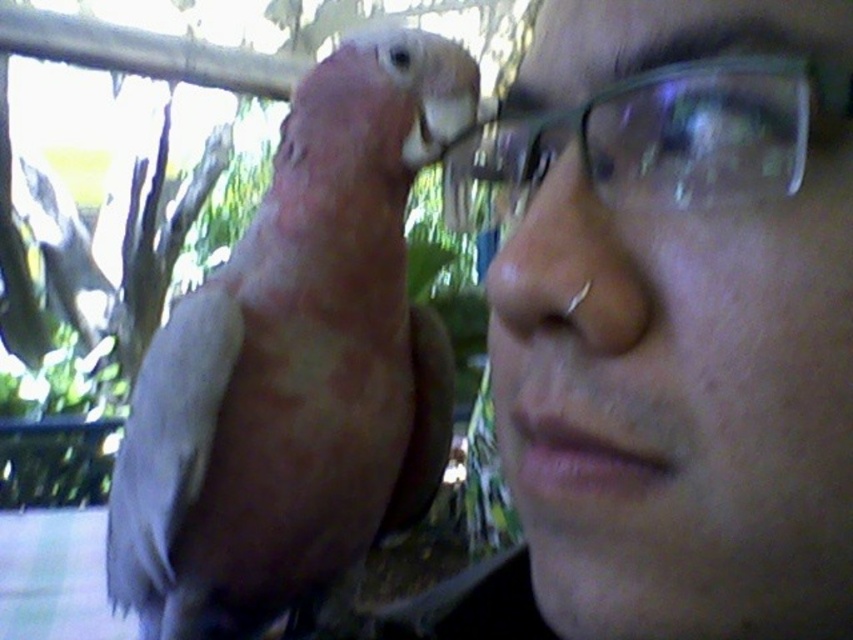
Who is lower down, matte pink parrot at upper left or clear plastic glasses at upper center?

matte pink parrot at upper left is lower down.

Does matte pink parrot at upper left appear over clear plastic glasses at upper center?

Incorrect, matte pink parrot at upper left is not positioned above clear plastic glasses at upper center.

At what (x,y) coordinates should I click in order to perform the action: click on matte pink parrot at upper left. Please return your answer as a coordinate pair (x, y). The height and width of the screenshot is (640, 853). Looking at the image, I should click on (296, 364).

Is clear glass glasses at upper right thinner than matte pink parrot at upper left?

Correct, clear glass glasses at upper right's width is less than matte pink parrot at upper left's.

Who is more distant from viewer, (590,488) or (316,225)?

The point (316,225) is behind.

At what (x,y) coordinates should I click in order to perform the action: click on clear glass glasses at upper right. Please return your answer as a coordinate pair (x, y). The image size is (853, 640). Looking at the image, I should click on (682, 408).

Is point (773, 189) positioned behind point (636, 465)?

No, (773, 189) is in front of (636, 465).

Who is more distant from viewer, (648,196) or (514,458)?

Point (514,458)

Identify the location of clear plastic glasses at upper center. (654, 138).